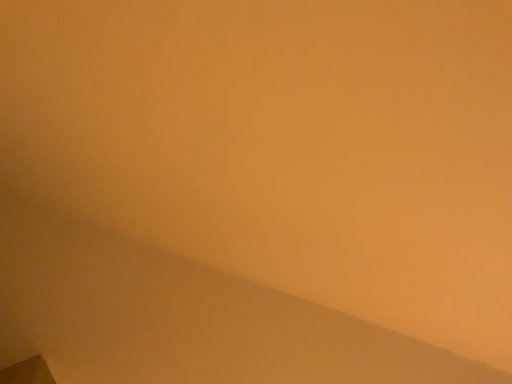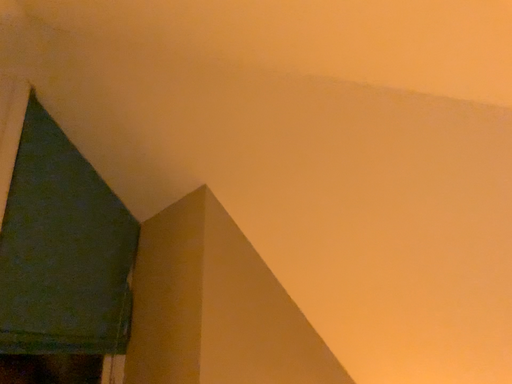
Question: Which way did the camera rotate in the video?

Choices:
 (A) rotated right
 (B) rotated left

Answer: (B)